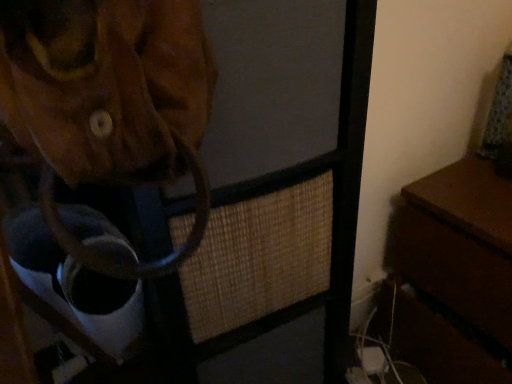
Question: Is brown leather bag at upper left shorter than brown wooden table at right?

Choices:
 (A) no
 (B) yes

Answer: (A)

Question: Can you confirm if brown leather bag at upper left is wider than brown wooden table at right?

Choices:
 (A) yes
 (B) no

Answer: (B)

Question: Is brown leather bag at upper left taller than brown wooden table at right?

Choices:
 (A) no
 (B) yes

Answer: (B)

Question: Does brown leather bag at upper left contain brown wooden table at right?

Choices:
 (A) yes
 (B) no

Answer: (B)

Question: Is brown leather bag at upper left facing away from brown wooden table at right?

Choices:
 (A) no
 (B) yes

Answer: (A)

Question: Can you confirm if brown leather bag at upper left is smaller than brown wooden table at right?

Choices:
 (A) yes
 (B) no

Answer: (B)

Question: Is brown leather bag at upper left inside brown wooden table at right?

Choices:
 (A) no
 (B) yes

Answer: (A)

Question: Does brown wooden table at right turn towards brown leather bag at upper left?

Choices:
 (A) no
 (B) yes

Answer: (B)

Question: From a real-world perspective, is brown wooden table at right on top of brown leather bag at upper left?

Choices:
 (A) no
 (B) yes

Answer: (A)

Question: Is brown wooden table at right closer to the viewer compared to brown leather bag at upper left?

Choices:
 (A) yes
 (B) no

Answer: (B)

Question: Is brown wooden table at right oriented away from brown leather bag at upper left?

Choices:
 (A) yes
 (B) no

Answer: (B)

Question: Is brown wooden table at right not within brown leather bag at upper left?

Choices:
 (A) no
 (B) yes

Answer: (B)

Question: Is brown leather bag at upper left inside or outside of brown wooden table at right?

Choices:
 (A) inside
 (B) outside

Answer: (B)